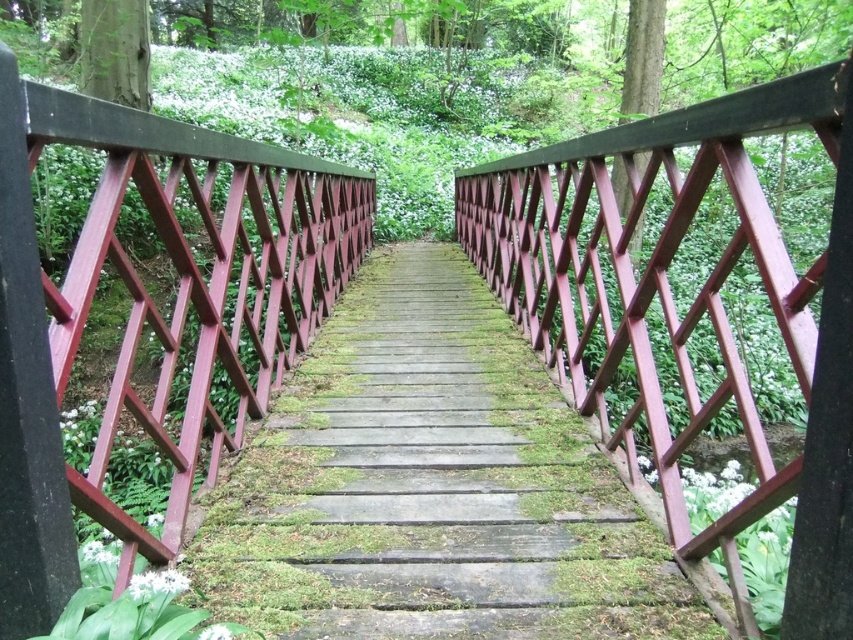
Between point (492, 246) and point (212, 148), which one is positioned behind?

The point (492, 246) is more distant.

Is matte red wooden rail at upper center above smooth red wooden balustrade at center?

No, matte red wooden rail at upper center is not above smooth red wooden balustrade at center.

Locate an element on the screen. matte red wooden rail at upper center is located at coordinates (689, 312).

At what (x,y) coordinates should I click in order to perform the action: click on matte red wooden rail at upper center. Please return your answer as a coordinate pair (x, y). This screenshot has width=853, height=640. Looking at the image, I should click on (689, 312).

Who is positioned more to the left, wooden stairs at center or matte red wooden rail at upper center?

Positioned to the left is wooden stairs at center.

Which of these two, wooden stairs at center or matte red wooden rail at upper center, stands shorter?

wooden stairs at center is shorter.

Is point (368, 412) closer to viewer compared to point (825, 476)?

That is False.

The width and height of the screenshot is (853, 640). Identify the location of wooden stairs at center. (432, 486).

Is wooden stairs at center wider than smooth red wooden balustrade at center?

Yes.

Between point (358, 508) and point (349, 168), which one is positioned in front?

Point (358, 508) is more forward.

Find the location of a particular element. The image size is (853, 640). wooden stairs at center is located at coordinates (432, 486).